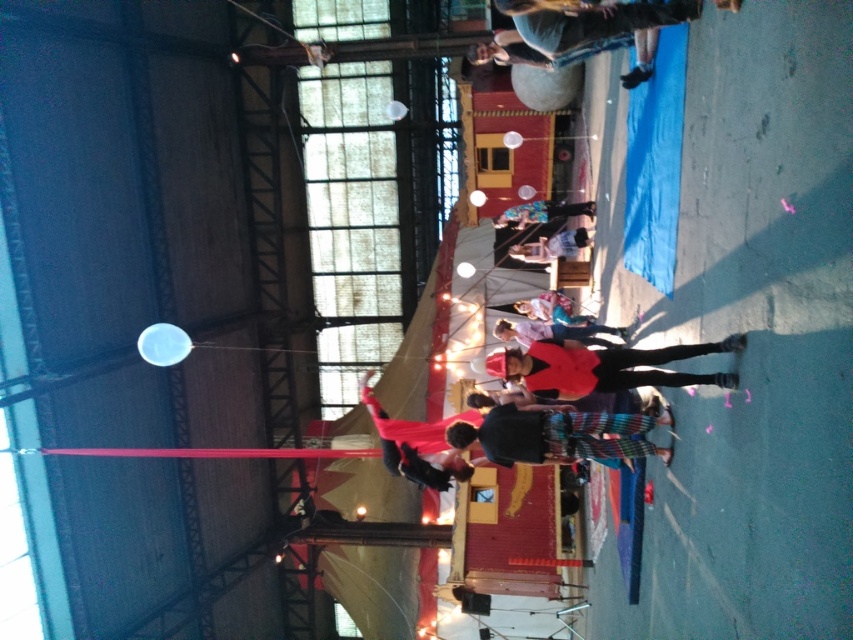
You are a photographer setting up for a performance. You need to focus on both the matte red jacket at center and the velvet red cape at center. Which object should you adjust your camera settings for if you want to capture details of the smaller one?

The matte red jacket at center is smaller than the velvet red cape at center, so you should adjust your camera settings for the matte red jacket at center to ensure its details are captured clearly.

You are a photographer positioned at the back of the hall. You need to capture a clear photo of both the matte red jacket at center and the matte red shirt at center. Which one is more likely to block the view of the other?

The matte red jacket at center is taller than the matte red shirt at center, so it is more likely to block the view of the matte red shirt at center.